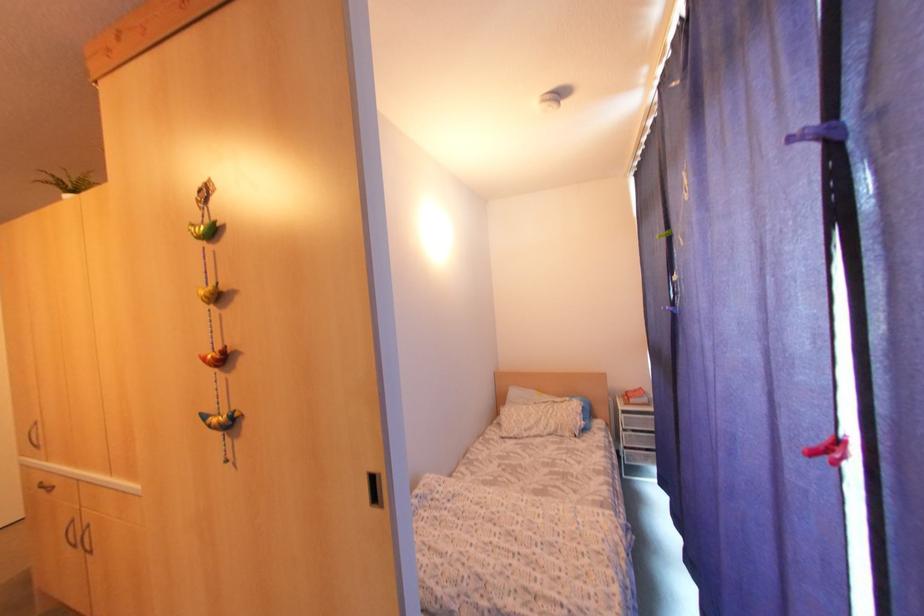
What do you see at coordinates (33, 435) in the screenshot?
I see `a cabinet door handle` at bounding box center [33, 435].